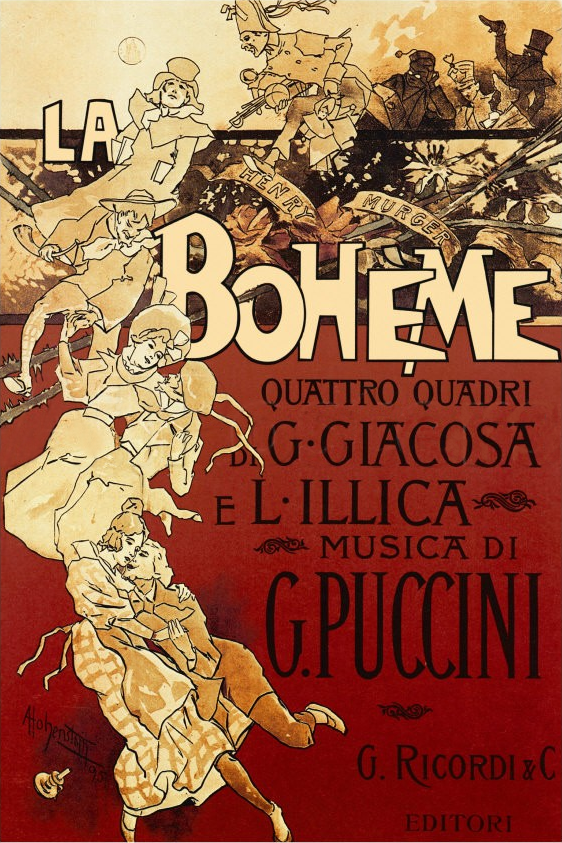
Locate an element on the screen. This screenshot has width=562, height=843. candle is located at coordinates (67, 777).